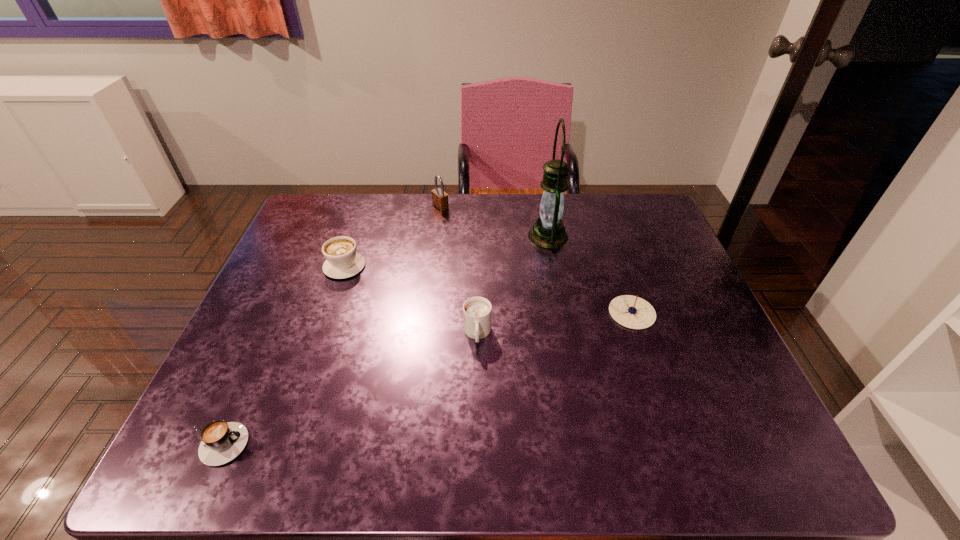
Where is `vacant space at the right edge of the desktop`? vacant space at the right edge of the desktop is located at coordinates (729, 417).

In the image, there is a desktop. Where is `vacant area at the far left corner`? The width and height of the screenshot is (960, 540). vacant area at the far left corner is located at coordinates (305, 208).

Image resolution: width=960 pixels, height=540 pixels. Find the location of `blank space at the far right corner`. blank space at the far right corner is located at coordinates (660, 224).

In the image, there is a desktop. Where is `vacant space at the near right corner`? vacant space at the near right corner is located at coordinates pyautogui.click(x=740, y=460).

Where is `blank region between the compass and the nearest object`? The image size is (960, 540). blank region between the compass and the nearest object is located at coordinates (424, 379).

Where is `vacant region between the leftmost cappuccino and the padlock`? This screenshot has height=540, width=960. vacant region between the leftmost cappuccino and the padlock is located at coordinates (328, 326).

In order to click on free spot between the lantern and the rightmost cappuccino in this screenshot , I will do `click(513, 285)`.

Where is `vacant area that lies between the tallest object and the nearest cappuccino`? Image resolution: width=960 pixels, height=540 pixels. vacant area that lies between the tallest object and the nearest cappuccino is located at coordinates (382, 340).

Locate an element on the screen. The height and width of the screenshot is (540, 960). free space between the second cappuccino from left to right and the rightmost object is located at coordinates (489, 289).

Where is `free point between the farthest cappuccino and the rightmost cappuccino`? This screenshot has height=540, width=960. free point between the farthest cappuccino and the rightmost cappuccino is located at coordinates (411, 300).